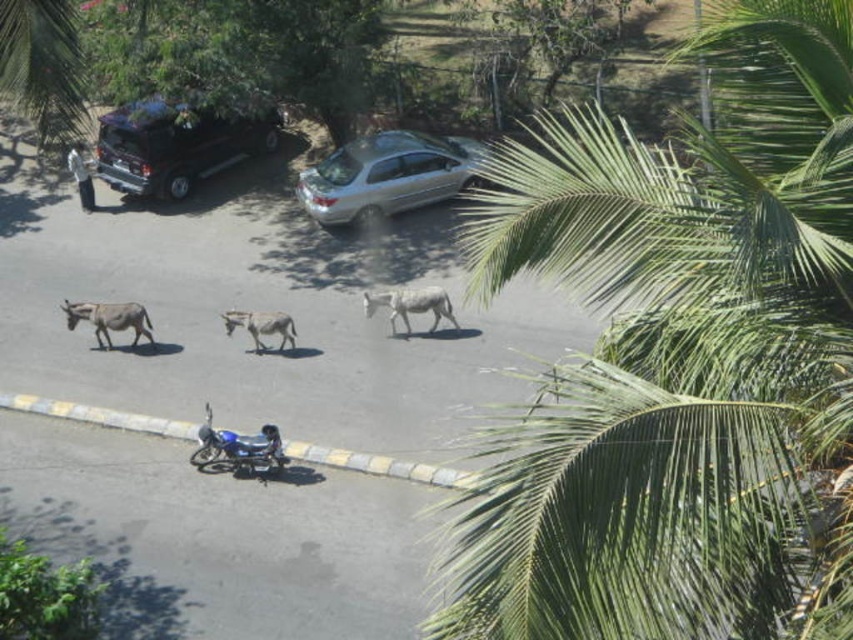
You are standing at the point with coordinates (386,176). What object are you standing on?

The point with coordinates (386,176) is on the silver metallic sedan at center.

Consider the image. You are standing at the edge of the paved area and want to walk towards the palm tree fronds in the foreground. Which point, point (190, 141) or point (263, 346), is closer to you as you move forward?

Point (190, 141) is closer to you because it is further to the viewer than point (263, 346), meaning it is nearer in the scene.